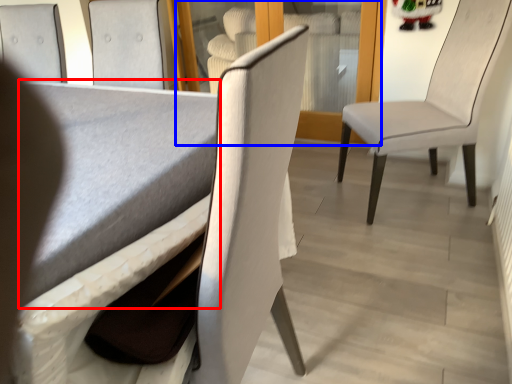
Question: Which object appears farthest to the camera in this image, table (highlighted by a red box) or glass door (highlighted by a blue box)?

Choices:
 (A) table
 (B) glass door

Answer: (B)